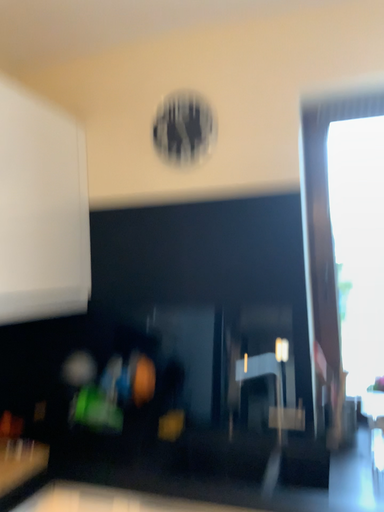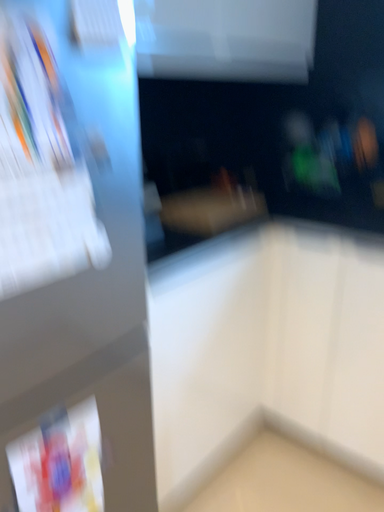
Question: Which way did the camera rotate in the video?

Choices:
 (A) rotated upward
 (B) rotated downward

Answer: (B)